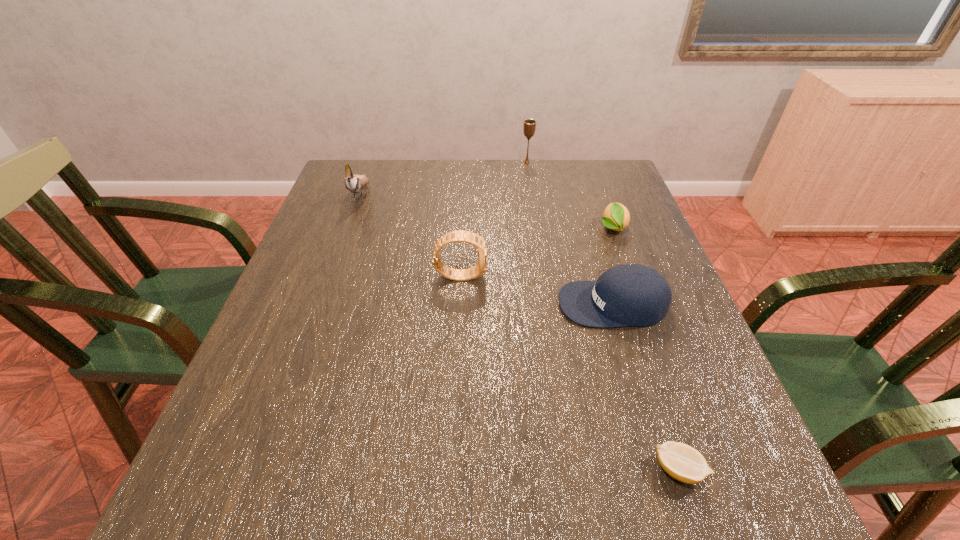
At what (x,y) coordinates should I click in order to perform the action: click on the farthest object. Please return your answer as a coordinate pair (x, y). Looking at the image, I should click on (529, 127).

Where is `the fourth object from right to left`? This screenshot has width=960, height=540. the fourth object from right to left is located at coordinates (529, 127).

Where is `bird`? The height and width of the screenshot is (540, 960). bird is located at coordinates (354, 183).

The image size is (960, 540). Find the location of `the leftmost object`. the leftmost object is located at coordinates (354, 183).

Find the location of a particular element. Image resolution: width=960 pixels, height=540 pixels. watch is located at coordinates (479, 269).

Locate an element on the screen. The width and height of the screenshot is (960, 540). baseball cap is located at coordinates (636, 295).

I want to click on the second shortest object, so click(616, 217).

Locate an element on the screen. the taller lemon is located at coordinates (616, 217).

Image resolution: width=960 pixels, height=540 pixels. I want to click on the shorter lemon, so click(682, 462).

Where is `the nearest object`? This screenshot has height=540, width=960. the nearest object is located at coordinates (682, 462).